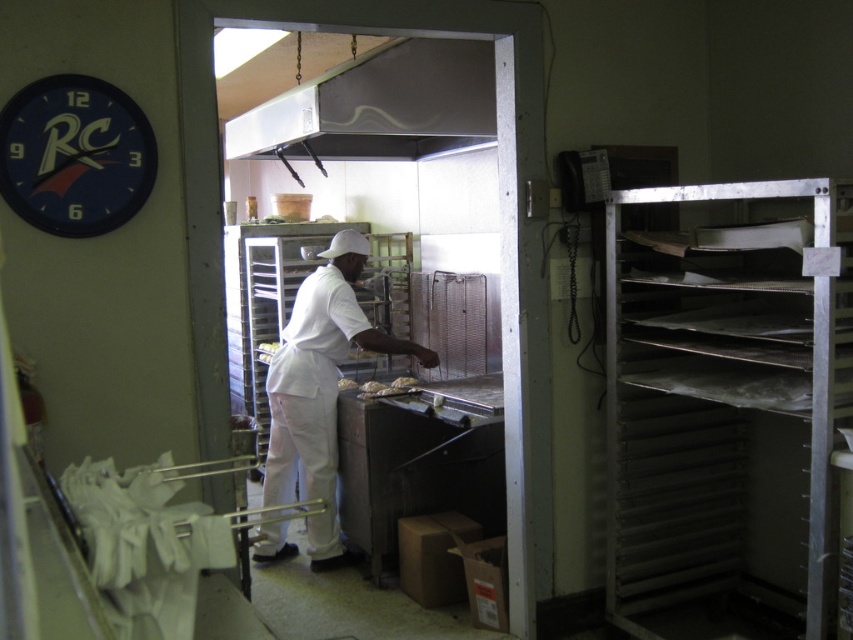
Does point (321, 472) come farther from viewer compared to point (408, 376)?

No, (321, 472) is closer to viewer.

Is white matte uniform at center to the right of golden brown pastry at center from the viewer's perspective?

In fact, white matte uniform at center is to the left of golden brown pastry at center.

Who is more forward, (296, 552) or (403, 376)?

Positioned in front is point (296, 552).

Find the location of `white matte uniform at center`. white matte uniform at center is located at coordinates (320, 390).

Does point (271, 412) come behind point (143, 138)?

Yes, it is.

Between white matte uniform at center and blue plastic clock at upper left, which one appears on the right side from the viewer's perspective?

white matte uniform at center

Which is behind, point (287, 444) or point (26, 147)?

The point (287, 444) is more distant.

I want to click on white matte uniform at center, so click(x=320, y=390).

Can you confirm if white matte bread at center is positioned to the right of golden brown bread at center?

No, white matte bread at center is not to the right of golden brown bread at center.

Does white matte bread at center have a smaller size compared to golden brown bread at center?

Actually, white matte bread at center might be larger than golden brown bread at center.

Is point (262, 342) positioned before point (345, 384)?

No, it is not.

Image resolution: width=853 pixels, height=640 pixels. What are the coordinates of `white matte bread at center` in the screenshot? It's located at coord(267,348).